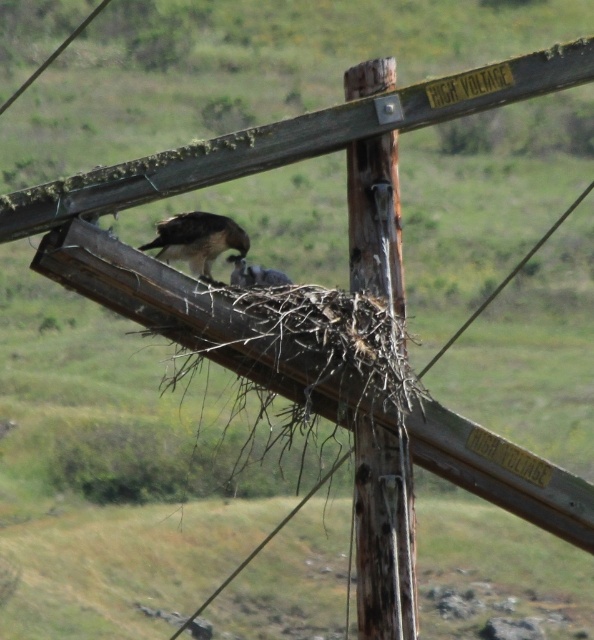
Question: Among these points, which one is nearest to the camera?

Choices:
 (A) (87, 17)
 (B) (352, 218)

Answer: (B)

Question: Considering the relative positions of brown wooden telegraph pole at center and smooth wire at upper left in the image provided, where is brown wooden telegraph pole at center located with respect to smooth wire at upper left?

Choices:
 (A) above
 (B) below

Answer: (B)

Question: Which object appears closest to the camera in this image?

Choices:
 (A) brown feathered falcon at center
 (B) smooth wire at upper left
 (C) brown wooden telegraph pole at center

Answer: (C)

Question: Is brown wooden telegraph pole at center behind brown feathered falcon at center?

Choices:
 (A) yes
 (B) no

Answer: (B)

Question: Does brown wooden telegraph pole at center have a larger size compared to smooth wire at upper left?

Choices:
 (A) yes
 (B) no

Answer: (B)

Question: Which point is closer to the camera taking this photo?

Choices:
 (A) (223, 221)
 (B) (396, 438)

Answer: (B)